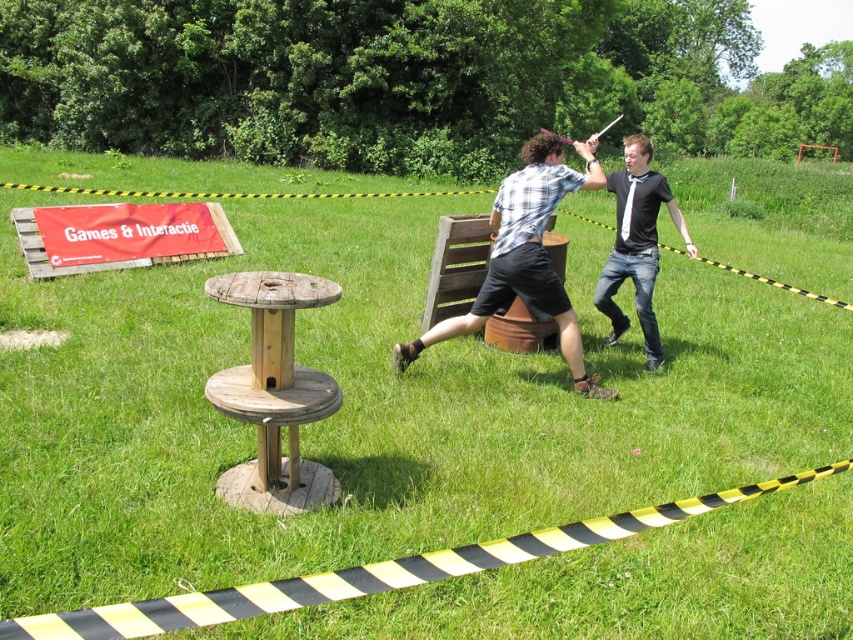
Does point (584, 145) come farther from viewer compared to point (624, 177)?

No, (584, 145) is closer to viewer.

Can you confirm if plaid shirt at center is smaller than black matte shirt at right?

Indeed, plaid shirt at center has a smaller size compared to black matte shirt at right.

Describe the element at coordinates (526, 256) in the screenshot. The width and height of the screenshot is (853, 640). I see `plaid shirt at center` at that location.

The image size is (853, 640). I want to click on plaid shirt at center, so click(526, 256).